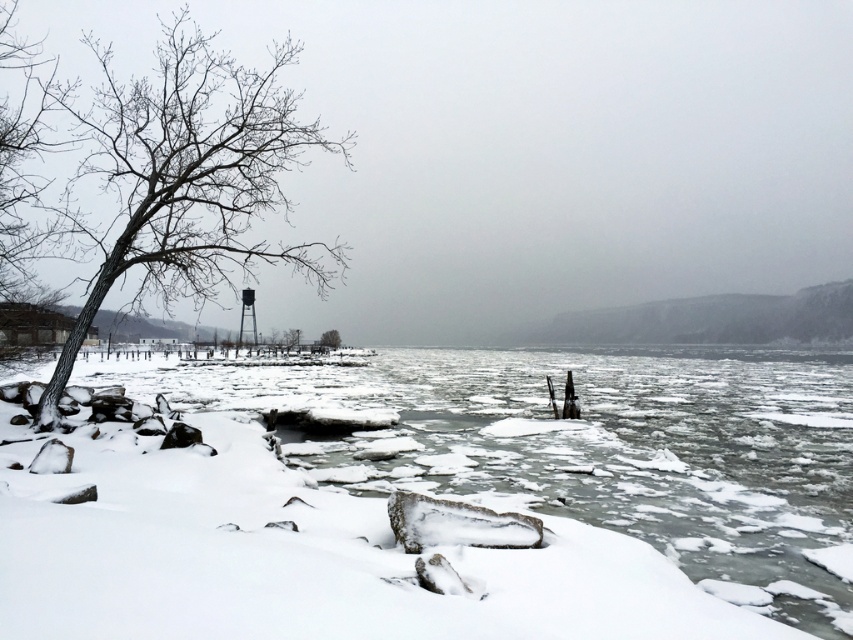
Question: Which point appears farthest from the camera in this image?

Choices:
 (A) (109, 125)
 (B) (329, 330)

Answer: (B)

Question: Is bare wood tree at left further to the viewer compared to bare wood tree at center?

Choices:
 (A) no
 (B) yes

Answer: (A)

Question: Is bare wood tree at left to the right of bare wood tree at center from the viewer's perspective?

Choices:
 (A) no
 (B) yes

Answer: (A)

Question: Can you confirm if bare wood tree at left is positioned to the left of bare wood tree at center?

Choices:
 (A) yes
 (B) no

Answer: (A)

Question: Which point appears closest to the camera in this image?

Choices:
 (A) (198, 192)
 (B) (334, 342)

Answer: (A)